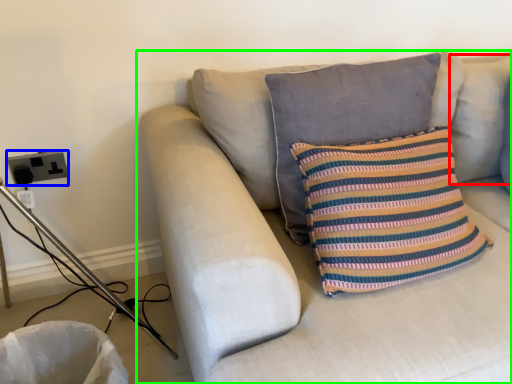
Question: Estimate the real-world distances between objects in this image. Which object is farther from pillow (highlighted by a red box), electric outlet (highlighted by a blue box) or studio couch (highlighted by a green box)?

Choices:
 (A) electric outlet
 (B) studio couch

Answer: (A)